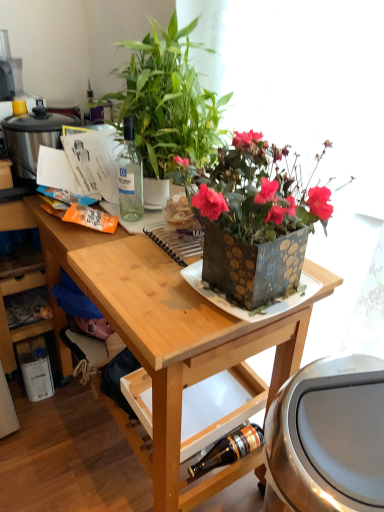
Question: Should I look upward or downward to see brushed metal trash can at lower right, placed as the 2th appliance when sorted from back to front?

Choices:
 (A) down
 (B) up

Answer: (A)

Question: Considering the relative sizes of transparent glass bottle at upper left, which ranks as the 1th bottle in top-to-bottom order, and stainless steel rice cooker at left, the 2th appliance in the bottom-to-top sequence, in the image provided, is transparent glass bottle at upper left, which ranks as the 1th bottle in top-to-bottom order, thinner than stainless steel rice cooker at left, the 2th appliance in the bottom-to-top sequence,?

Choices:
 (A) yes
 (B) no

Answer: (A)

Question: From the image's perspective, is transparent glass bottle at upper left, which ranks as the 1th bottle in top-to-bottom order, on stainless steel rice cooker at left, the 1th appliance when ordered from top to bottom?

Choices:
 (A) yes
 (B) no

Answer: (B)

Question: Considering the relative sizes of transparent glass bottle at upper left, the 2th bottle from the right, and stainless steel rice cooker at left, which ranks as the 1th appliance in back-to-front order, in the image provided, is transparent glass bottle at upper left, the 2th bottle from the right, smaller than stainless steel rice cooker at left, which ranks as the 1th appliance in back-to-front order,?

Choices:
 (A) no
 (B) yes

Answer: (B)

Question: From a real-world perspective, is transparent glass bottle at upper left, which ranks as the 1th bottle in top-to-bottom order, located beneath stainless steel rice cooker at left, marked as the second appliance in a right-to-left arrangement?

Choices:
 (A) no
 (B) yes

Answer: (A)

Question: Is stainless steel rice cooker at left, which is the second appliance in front-to-back order, inside transparent glass bottle at upper left, which ranks as the 1th bottle in top-to-bottom order?

Choices:
 (A) no
 (B) yes

Answer: (A)

Question: Does transparent glass bottle at upper left, positioned as the 1th bottle in left-to-right order, have a lesser height compared to stainless steel rice cooker at left, the 1th appliance when ordered from top to bottom?

Choices:
 (A) no
 (B) yes

Answer: (A)

Question: Does brown glass bottle at lower center, arranged as the 2th bottle when viewed from the top, contain metallic square plate at center?

Choices:
 (A) yes
 (B) no

Answer: (B)

Question: Can you confirm if brown glass bottle at lower center, marked as the second bottle in a left-to-right arrangement, is taller than metallic square plate at center?

Choices:
 (A) no
 (B) yes

Answer: (B)

Question: Does brown glass bottle at lower center, positioned as the first bottle in bottom-to-top order, have a lesser height compared to metallic square plate at center?

Choices:
 (A) no
 (B) yes

Answer: (A)

Question: From the image's perspective, is brown glass bottle at lower center, positioned as the first bottle in bottom-to-top order, beneath metallic square plate at center?

Choices:
 (A) no
 (B) yes

Answer: (B)

Question: From a real-world perspective, is brown glass bottle at lower center, which is counted as the first bottle, starting from the right, on top of metallic square plate at center?

Choices:
 (A) no
 (B) yes

Answer: (A)

Question: From a real-world perspective, is brown glass bottle at lower center, arranged as the 2th bottle when viewed from the top, below metallic square plate at center?

Choices:
 (A) yes
 (B) no

Answer: (A)

Question: From the image's perspective, is stainless steel rice cooker at left, which ranks as the 1th appliance in left-to-right order, above brushed metal trash can at lower right, which is the first appliance in front-to-back order?

Choices:
 (A) yes
 (B) no

Answer: (A)